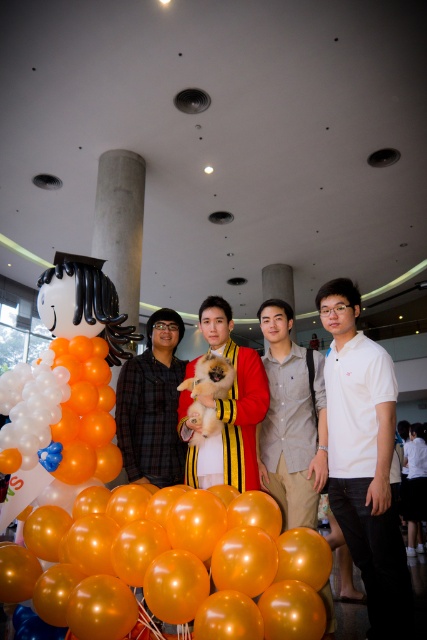
Question: Can you confirm if plaid fabric shirt at center is smaller than velvet-like red scarf at center?

Choices:
 (A) yes
 (B) no

Answer: (B)

Question: Among these objects, which one is nearest to the camera?

Choices:
 (A) orange matte balloons at center
 (B) velvet-like red scarf at center

Answer: (A)

Question: Can you confirm if white cotton polo shirt at right is wider than fluffy fur dog at center?

Choices:
 (A) yes
 (B) no

Answer: (A)

Question: Which point appears closest to the camera in this image?

Choices:
 (A) [x=319, y=401]
 (B) [x=164, y=432]
 (C) [x=85, y=445]

Answer: (C)

Question: Which object is farther from the camera taking this photo?

Choices:
 (A) fluffy fur dog at center
 (B) concrete pillar at center

Answer: (B)

Question: Can you confirm if white cotton polo shirt at right is thinner than velvet-like red scarf at center?

Choices:
 (A) no
 (B) yes

Answer: (B)